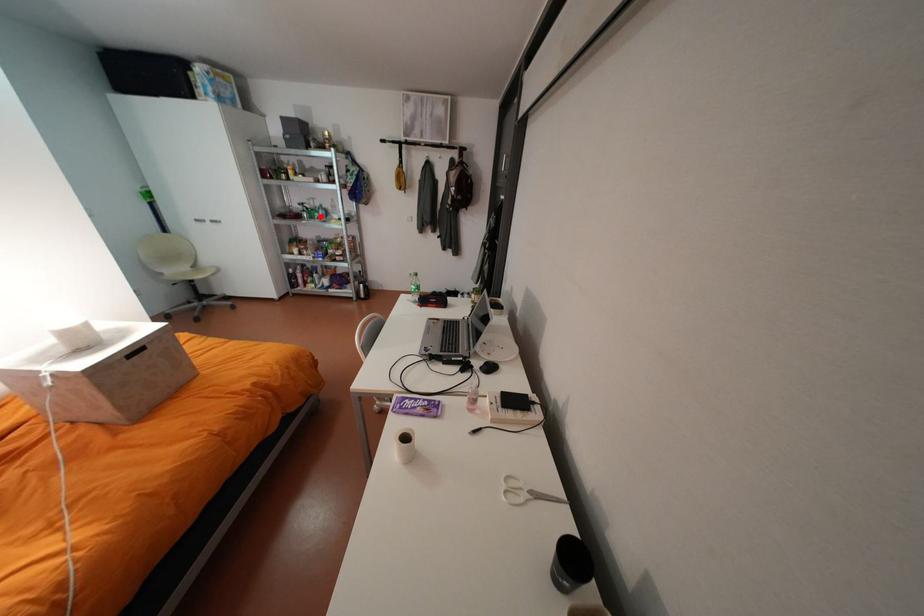
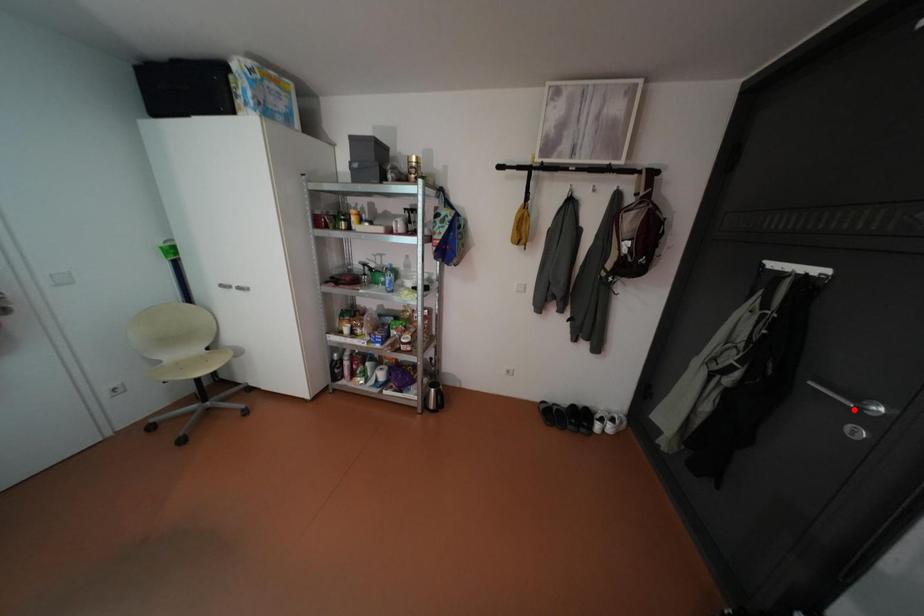
I am providing you with two images of the same scene from different viewpoints. A red point is marked on the first image and another point is marked on the second image. Is the red point in image1 aligned with the point shown in image2?

No